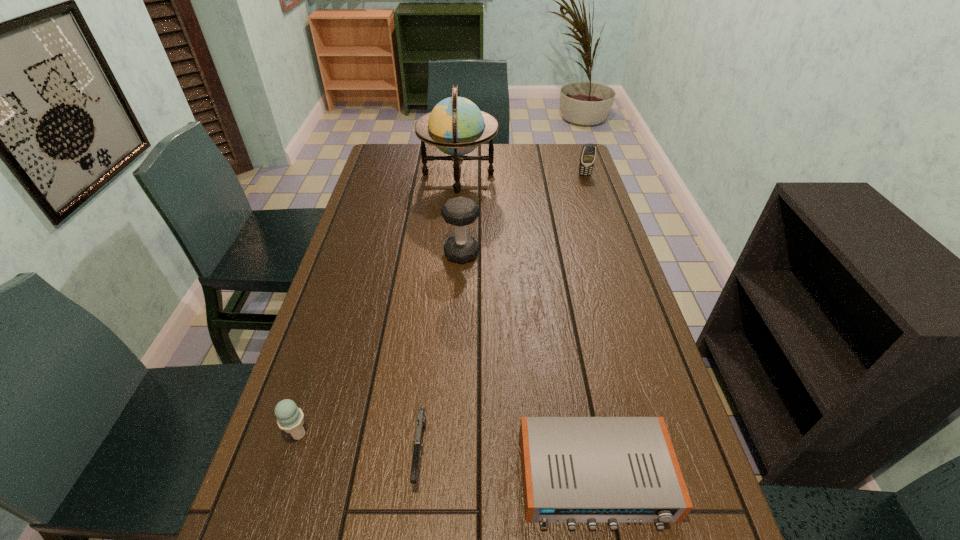
Where is `globe`? The image size is (960, 540). globe is located at coordinates (456, 126).

Find the location of a particular element. The image size is (960, 540). the fifth shortest object is located at coordinates pyautogui.click(x=459, y=211).

Image resolution: width=960 pixels, height=540 pixels. In order to click on the third farthest object in this screenshot , I will do `click(459, 211)`.

This screenshot has height=540, width=960. In order to click on cellular telephone in this screenshot , I will do `click(587, 158)`.

The image size is (960, 540). In order to click on ice cream in this screenshot , I will do `click(290, 418)`.

Find the location of `radio receiver`. radio receiver is located at coordinates (574, 469).

Where is `gun`? This screenshot has height=540, width=960. gun is located at coordinates click(x=421, y=418).

This screenshot has width=960, height=540. What are the coordinates of `vacant space located on the surface of the globe` in the screenshot? It's located at (540, 174).

Image resolution: width=960 pixels, height=540 pixels. Find the location of `free space located on the back of the third farthest object`. free space located on the back of the third farthest object is located at coordinates (465, 185).

The image size is (960, 540). Identify the location of vacant region located on the front face of the rightmost object. (600, 220).